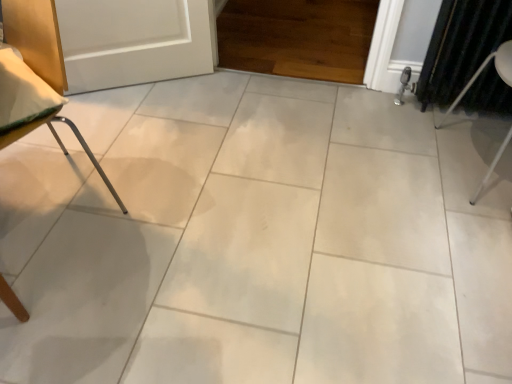
Locate an element on the screen. This screenshot has height=384, width=512. vacant point to the right of metallic silver chair leg at left, positioned as the second furniture in right-to-left order is located at coordinates (170, 217).